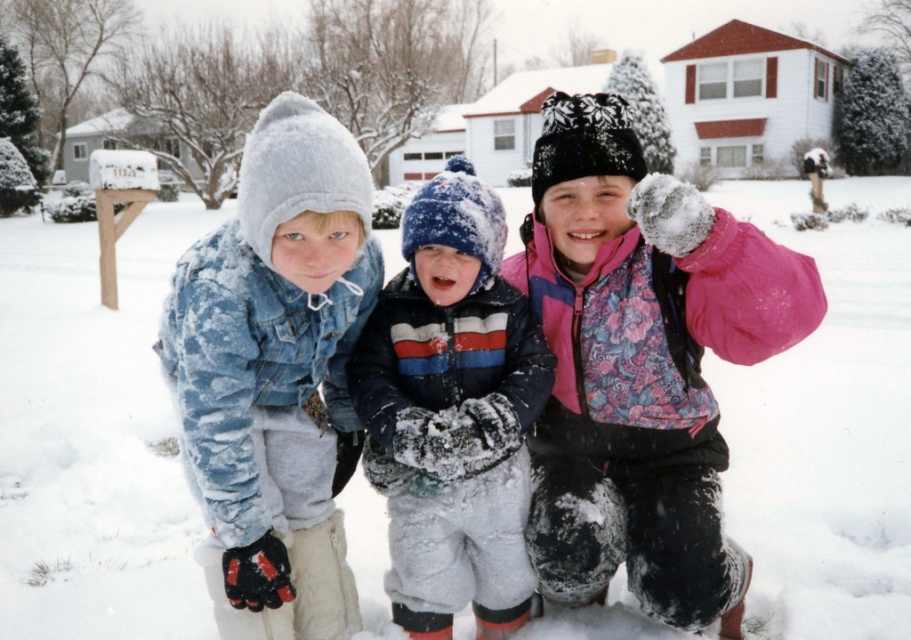
You are standing at the origin point of the coordinate system where the bottom left corner is the origin. The pink fleece jacket at center is located at point (640, 365). If you want to walk towards the pink fleece jacket at center, which direction should you move?

Since the point (640, 365) is on the pink fleece jacket at center, you should move towards the center of the image to reach it.

You are a parent trying to dress your child for a winter day. You have two jackets available in the image, the fuzzy denim jacket at center and the striped fleece jacket at center. Which jacket is closer to your child if they are standing at the center of the image?

The fuzzy denim jacket at center and the striped fleece jacket at center are 14.55 inches apart from each other. Since both jackets are at the center, the distance depends on their exact positions. However, the question states the child is at the center, so both jackets are equally distant. But since the parent needs to choose, perhaps the question is flawed. Wait, the objects description says they are 14.55 inches apart. So neither is closer. Hmm, maybe the question should be rephrased to ask which is to a